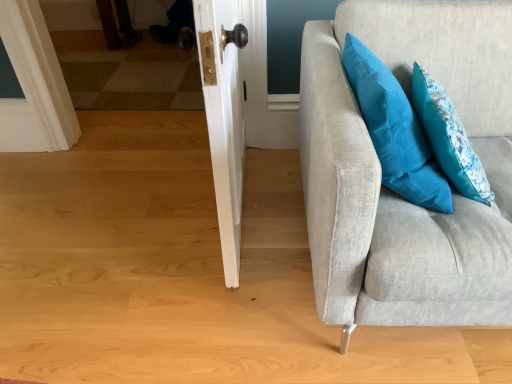
Question: From the image's perspective, would you say teal fabric pillow at upper right, positioned as the 2th pillow in right-to-left order, is positioned over light gray fabric couch at right?

Choices:
 (A) no
 (B) yes

Answer: (B)

Question: From a real-world perspective, is teal fabric pillow at upper right, the 1th pillow when ordered from left to right, over light gray fabric couch at right?

Choices:
 (A) yes
 (B) no

Answer: (A)

Question: From a real-world perspective, is teal fabric pillow at upper right, the 1th pillow when ordered from left to right, physically below light gray fabric couch at right?

Choices:
 (A) no
 (B) yes

Answer: (A)

Question: Can you confirm if teal fabric pillow at upper right, the 1th pillow when ordered from left to right, is shorter than light gray fabric couch at right?

Choices:
 (A) no
 (B) yes

Answer: (B)

Question: Is teal fabric pillow at upper right, positioned as the 2th pillow in right-to-left order, oriented towards light gray fabric couch at right?

Choices:
 (A) no
 (B) yes

Answer: (B)

Question: Considering the positions of teal fabric pillow at upper right, placed as the 1th pillow when sorted from right to left, and light gray fabric couch at right in the image, is teal fabric pillow at upper right, placed as the 1th pillow when sorted from right to left, wider or thinner than light gray fabric couch at right?

Choices:
 (A) wide
 (B) thin

Answer: (B)

Question: From a real-world perspective, relative to light gray fabric couch at right, is teal fabric pillow at upper right, which is counted as the 2th pillow, starting from the left, vertically above or below?

Choices:
 (A) above
 (B) below

Answer: (A)

Question: Considering their positions, is teal fabric pillow at upper right, placed as the 1th pillow when sorted from right to left, located in front of or behind light gray fabric couch at right?

Choices:
 (A) front
 (B) behind

Answer: (B)

Question: Would you say teal fabric pillow at upper right, which is counted as the 2th pillow, starting from the left, is to the left or to the right of light gray fabric couch at right in the picture?

Choices:
 (A) left
 (B) right

Answer: (A)

Question: Would you say teal fabric pillow at upper right, positioned as the 2th pillow in right-to-left order, is to the left or to the right of teal fabric pillow at upper right, placed as the 1th pillow when sorted from right to left, in the picture?

Choices:
 (A) right
 (B) left

Answer: (B)

Question: In terms of size, does teal fabric pillow at upper right, positioned as the 2th pillow in right-to-left order, appear bigger or smaller than teal fabric pillow at upper right, placed as the 1th pillow when sorted from right to left?

Choices:
 (A) big
 (B) small

Answer: (A)

Question: Relative to teal fabric pillow at upper right, placed as the 1th pillow when sorted from right to left, is teal fabric pillow at upper right, positioned as the 2th pillow in right-to-left order, in front or behind?

Choices:
 (A) behind
 (B) front

Answer: (B)

Question: From a real-world perspective, is teal fabric pillow at upper right, positioned as the 2th pillow in right-to-left order, above or below teal fabric pillow at upper right, which is counted as the 2th pillow, starting from the left?

Choices:
 (A) below
 (B) above

Answer: (B)

Question: From a real-world perspective, relative to teal fabric pillow at upper right, positioned as the 2th pillow in right-to-left order, is teal fabric pillow at upper right, which is counted as the 2th pillow, starting from the left, vertically above or below?

Choices:
 (A) below
 (B) above

Answer: (A)

Question: Visually, is teal fabric pillow at upper right, placed as the 1th pillow when sorted from right to left, positioned to the left or to the right of teal fabric pillow at upper right, the 1th pillow when ordered from left to right?

Choices:
 (A) left
 (B) right

Answer: (B)